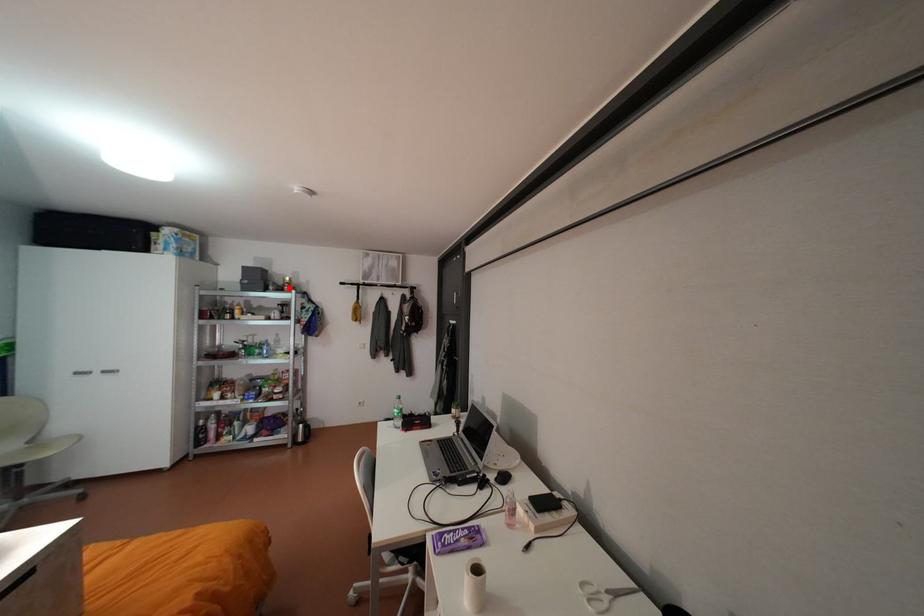
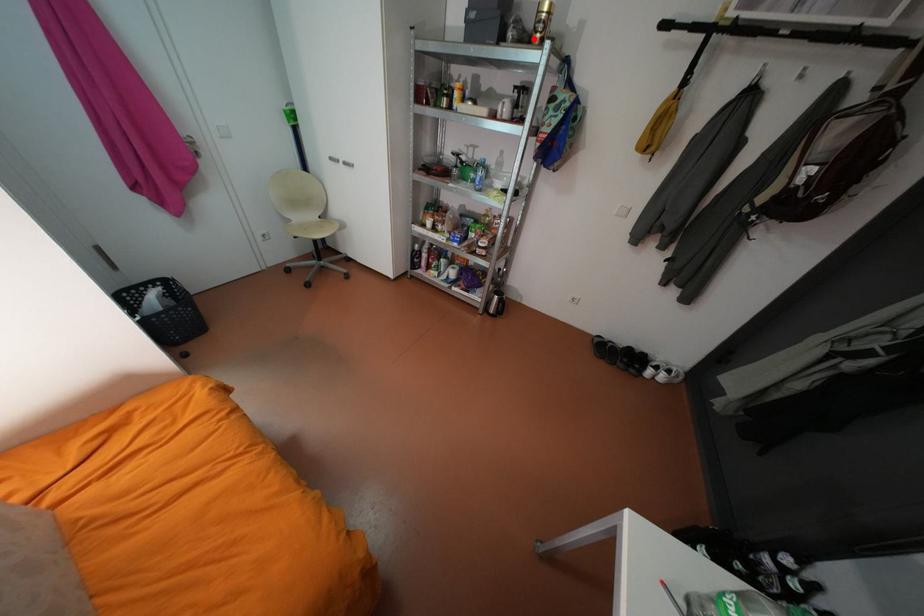
In the scene shown: I am providing you with two images of the same scene from different viewpoints. A red point is marked on the first image and another point is marked on the second image. Are the points marked in image1 and image2 representing the same 3D position?

Yes